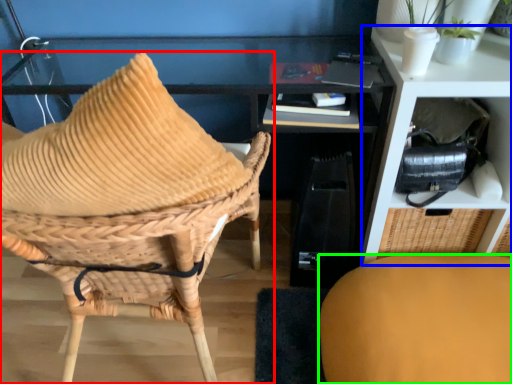
Question: Considering the real-world distances, which object is closest to chair (highlighted by a red box)? shelf (highlighted by a blue box) or chair (highlighted by a green box).

Choices:
 (A) shelf
 (B) chair

Answer: (B)